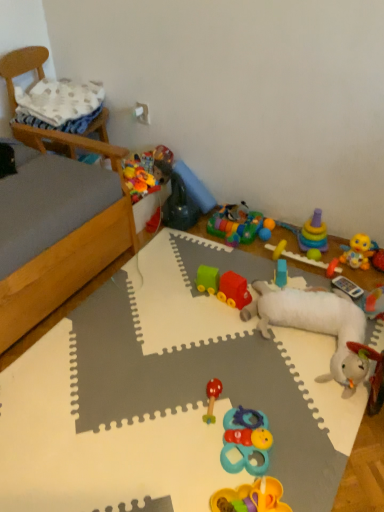
Where is `free space to the left of multicolored plastic toy at upper right, the fifth toy when ordered from top to bottom`? free space to the left of multicolored plastic toy at upper right, the fifth toy when ordered from top to bottom is located at coordinates (258, 264).